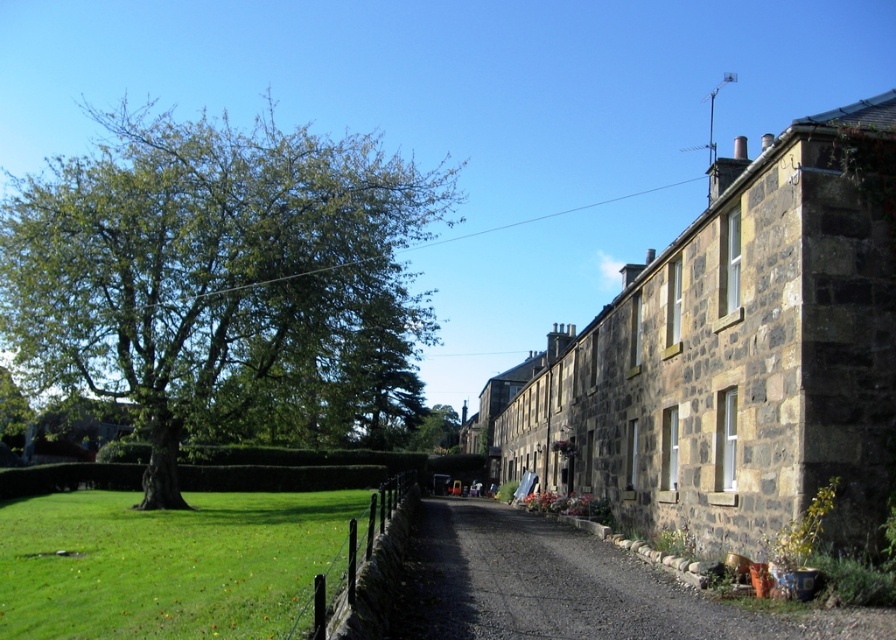
You are standing at the center of the gravel path in front of the row of stone houses. You notice two points marked in the scene. Which point, point (82, 579) or point (714, 624), is closer to you?

Point (82, 579) is closer to you because it is further to the viewer than point (714, 624).

You are a gardener planning to plant a new tree in the rural scene. Considering the existing green leafy tree at left and the gray gravel driveway at center, which object is taller and would cast a shadow over the driveway?

The green leafy tree at left is taller than the gray gravel driveway at center, so it would cast a shadow over the driveway.

You are planning to plant a garden in the area shown in the image. The green grass at lower left and the gray gravel driveway at center are both potential locations. Based on their sizes, which area would provide more space for planting? Please explain your reasoning.

The green grass at lower left is larger in size than the gray gravel driveway at center, so it would provide more space for planting.